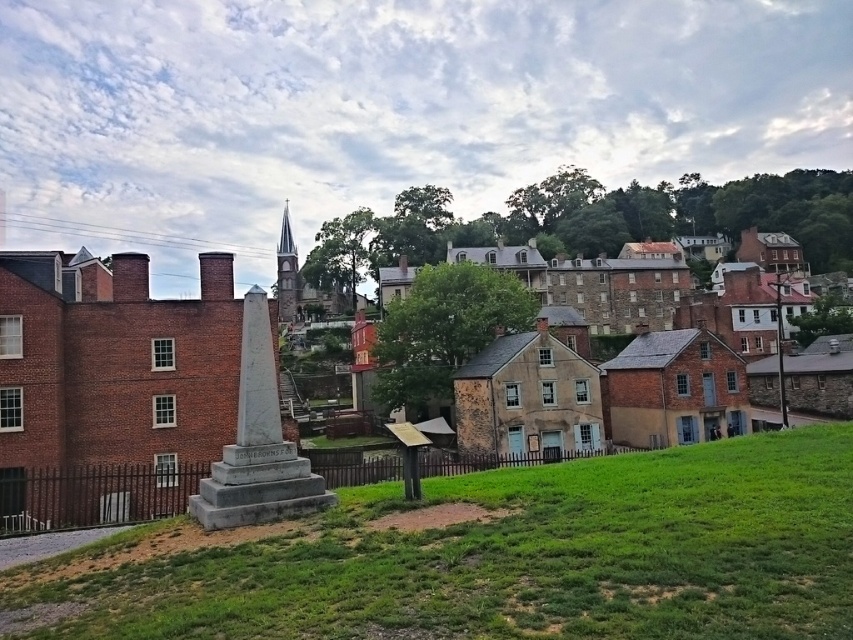
You are a visitor in the historic town and want to take a photo of both the green grassy at center and the gray marble obelisk at center. Which object should you focus on first if you want to include both in your frame without moving the camera?

You should focus on the gray marble obelisk at center first because it is larger than the green grassy at center, ensuring it fits properly in the frame.

Based on the photo, you are standing in the historic town square and want to take a photo of the smooth gray stone steeple at upper center. Where should you position yourself to capture it in the frame?

You should position yourself at point (287, 273) to capture the smooth gray stone steeple at upper center in the frame.